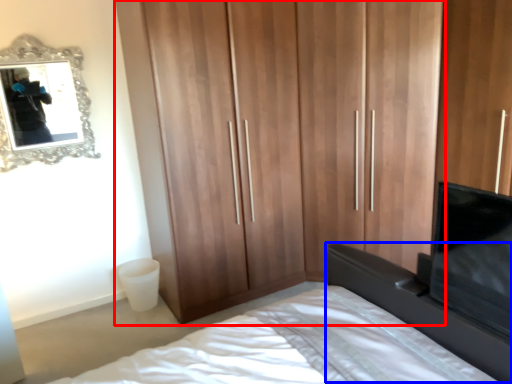
Question: Which object is further to the camera taking this photo, cupboard (highlighted by a red box) or vanity (highlighted by a blue box)?

Choices:
 (A) cupboard
 (B) vanity

Answer: (A)